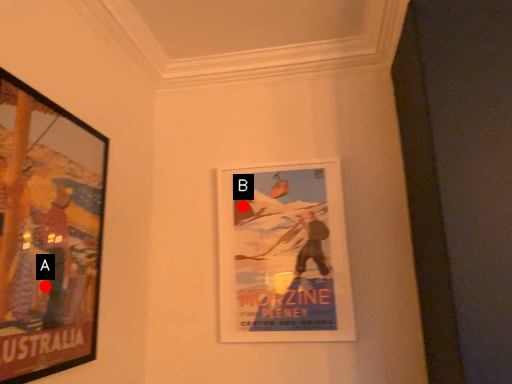
Question: Two points are circled on the image, labeled by A and B beside each circle. Which of the following is the farthest from the observer?

Choices:
 (A) A is further
 (B) B is further

Answer: (B)